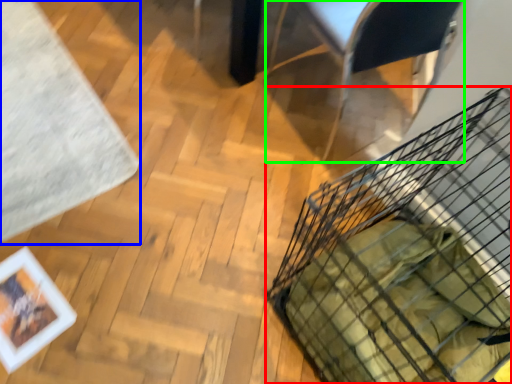
Question: Which is farther away from basket (highlighted by a red box)? mat (highlighted by a blue box) or armchair (highlighted by a green box)?

Choices:
 (A) mat
 (B) armchair

Answer: (A)